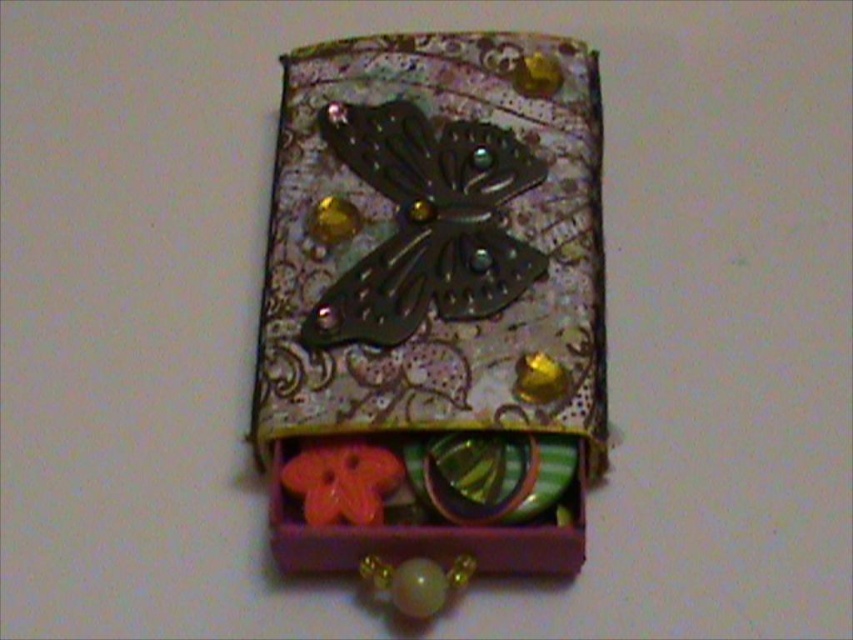
Question: Is metallic dark brown butterfly at center to the right of rubberized plastic flower at center from the viewer's perspective?

Choices:
 (A) yes
 (B) no

Answer: (A)

Question: Among these points, which one is nearest to the camera?

Choices:
 (A) (398, 196)
 (B) (426, 65)
 (C) (380, 516)

Answer: (C)

Question: Which point is farther to the camera?

Choices:
 (A) (463, 125)
 (B) (325, 131)
 (C) (397, 470)

Answer: (A)

Question: Can you confirm if metallic dark brown butterfly at center is thinner than rubberized plastic flower at center?

Choices:
 (A) no
 (B) yes

Answer: (A)

Question: Which object appears closest to the camera in this image?

Choices:
 (A) metallic butterfly at center
 (B) rubberized plastic flower at center

Answer: (A)

Question: Does metallic dark brown butterfly at center appear under rubberized plastic flower at center?

Choices:
 (A) no
 (B) yes

Answer: (A)